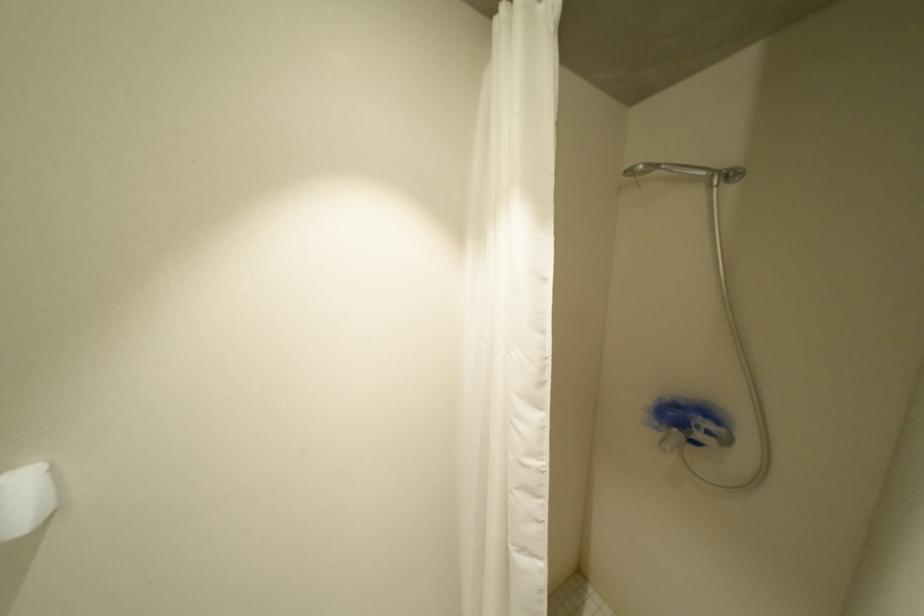
At what (x,y) coordinates should I click in order to perform the action: click on silver shower head. Please return your answer as a coordinate pair (x, y). The width and height of the screenshot is (924, 616). Looking at the image, I should click on (687, 171).